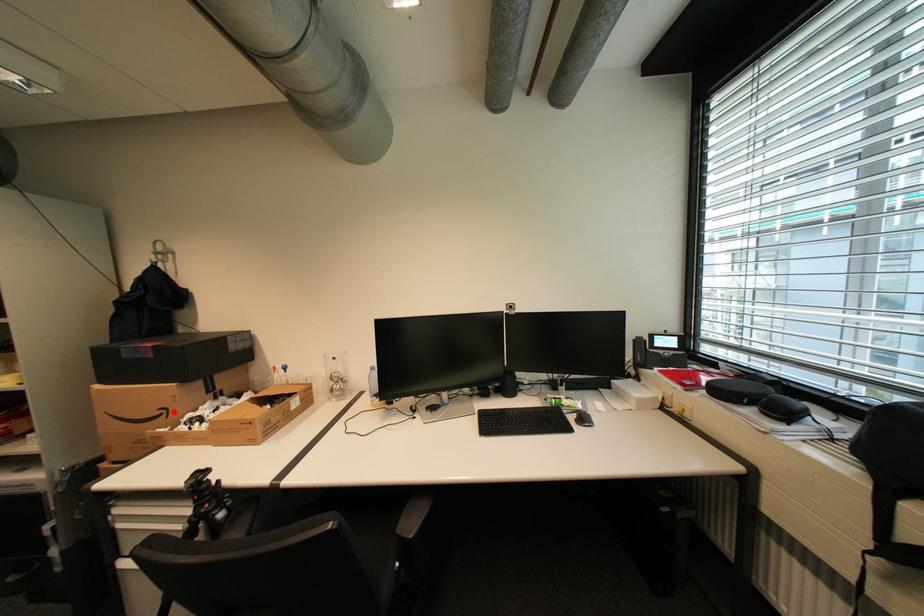
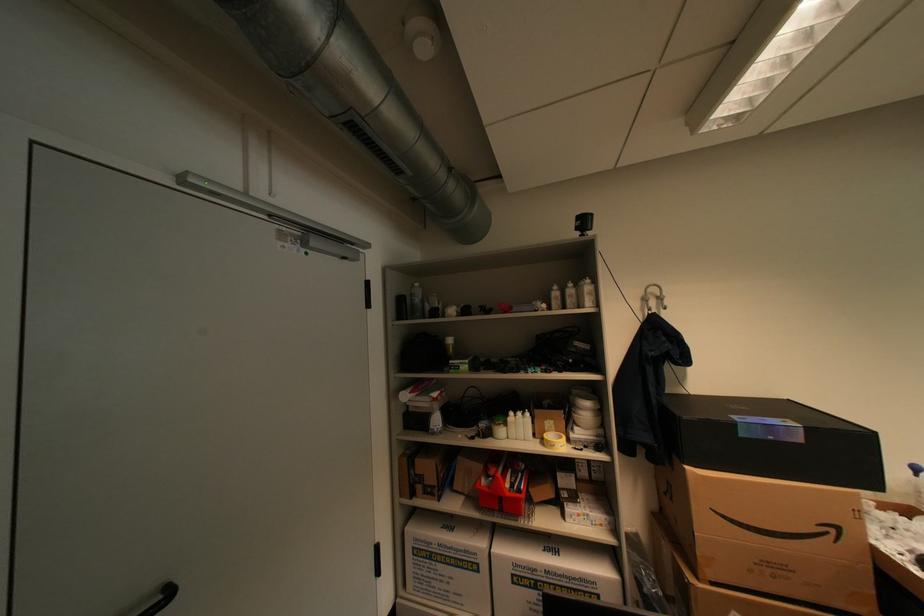
Where in the second image is the point corresponding to the highlighted location from the first image?

(841, 531)